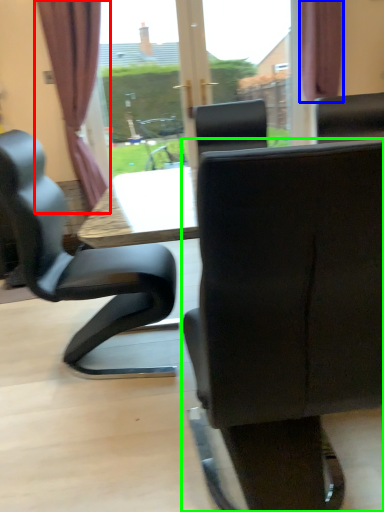
Question: Estimate the real-world distances between objects in this image. Which object is closer to curtain (highlighted by a red box), curtain (highlighted by a blue box) or chair (highlighted by a green box)?

Choices:
 (A) curtain
 (B) chair

Answer: (A)